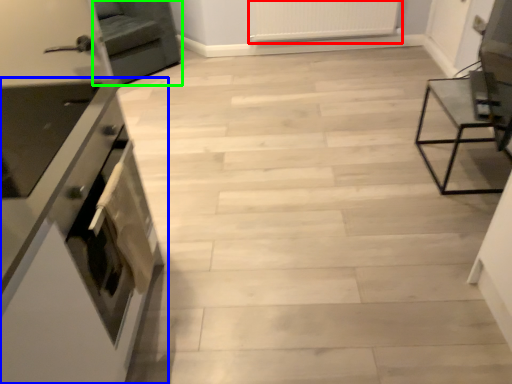
Question: Considering the real-world distances, which object is farthest from radiator (highlighted by a red box)? cabinetry (highlighted by a blue box) or armchair (highlighted by a green box)?

Choices:
 (A) cabinetry
 (B) armchair

Answer: (A)